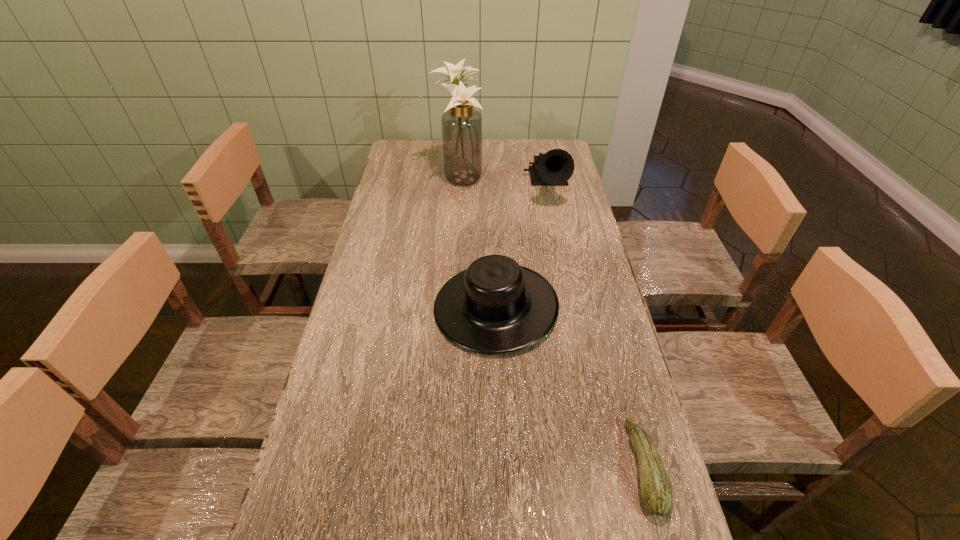
Locate an element on the screen. Image resolution: width=960 pixels, height=540 pixels. blank space located 0.310m at the stem end of the nearest object is located at coordinates (482, 467).

The width and height of the screenshot is (960, 540). I want to click on blank space located at the stem end of the nearest object, so click(544, 467).

Identify the location of flower arrangement present at the far edge. The width and height of the screenshot is (960, 540). (461, 124).

Where is `phonograph_record that is at the far edge`? This screenshot has width=960, height=540. phonograph_record that is at the far edge is located at coordinates (554, 168).

Locate an element on the screen. phonograph_record positioned at the right edge is located at coordinates (554, 168).

Locate an element on the screen. Image resolution: width=960 pixels, height=540 pixels. dress hat positioned at the right edge is located at coordinates (495, 306).

Identify the location of zucchini that is at the right edge. (656, 491).

Where is `object that is at the far right corner`? This screenshot has width=960, height=540. object that is at the far right corner is located at coordinates (554, 168).

You are a GUI agent. You are given a task and a screenshot of the screen. Output one action in this format:
    pyautogui.click(x=<x>, y=<y>)
    Task: Click on the vacant space at the left edge
    The image size is (960, 540).
    Given the screenshot: What is the action you would take?
    pyautogui.click(x=372, y=484)

Find the location of a particular element. The height and width of the screenshot is (540, 960). vacant area at the right edge of the desktop is located at coordinates (584, 215).